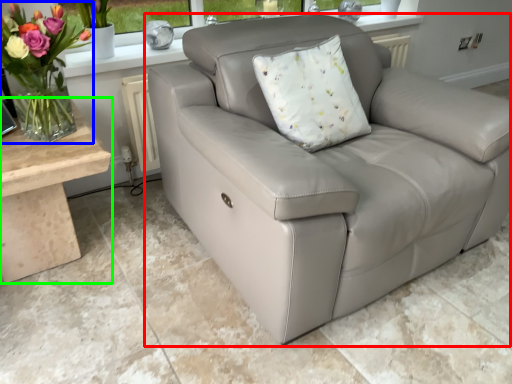
Question: Based on their relative distances, which object is farther from studio couch (highlighted by a red box)? Choose from floral arrangement (highlighted by a blue box) and table (highlighted by a green box).

Choices:
 (A) floral arrangement
 (B) table

Answer: (A)